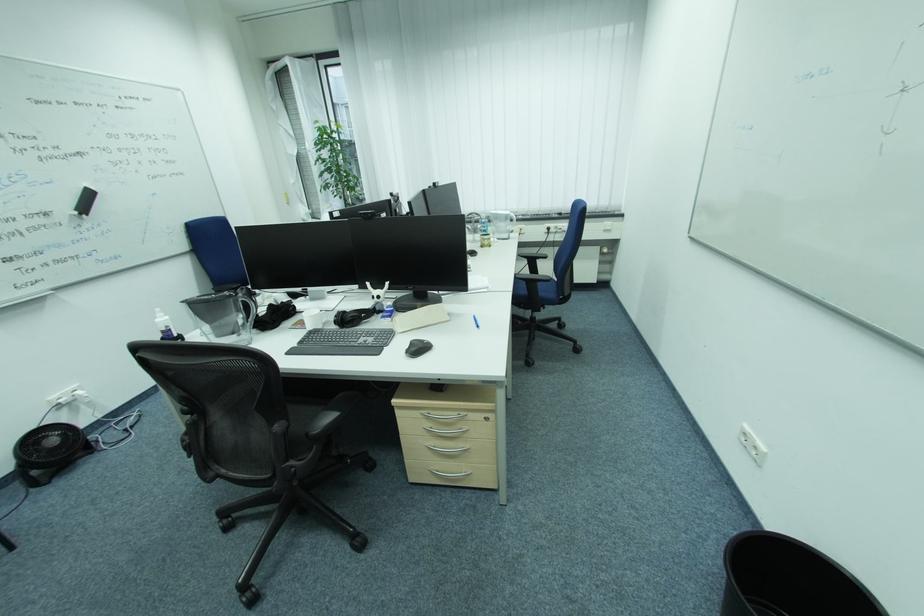
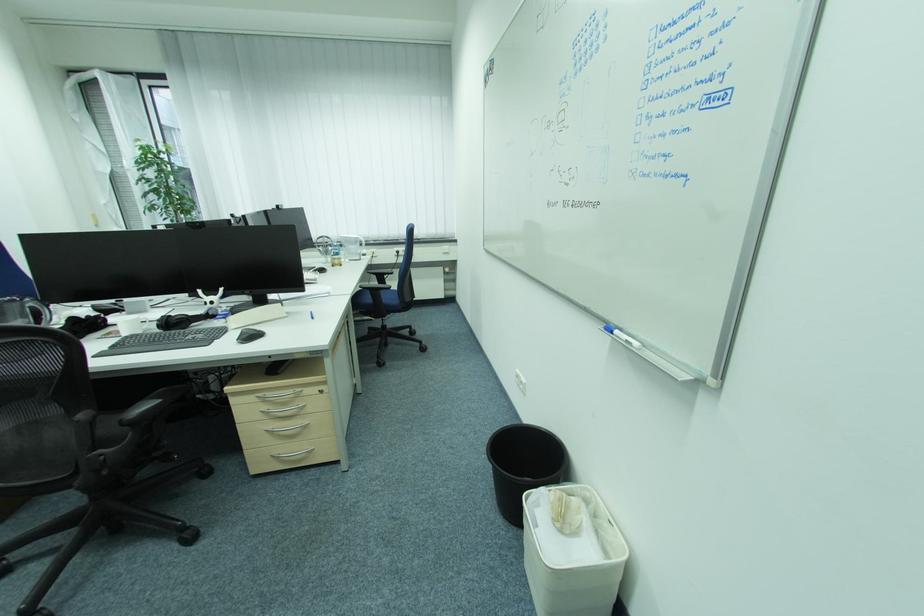
Find the pixel in the second image that matches (x=294, y=462) in the first image.

(102, 452)